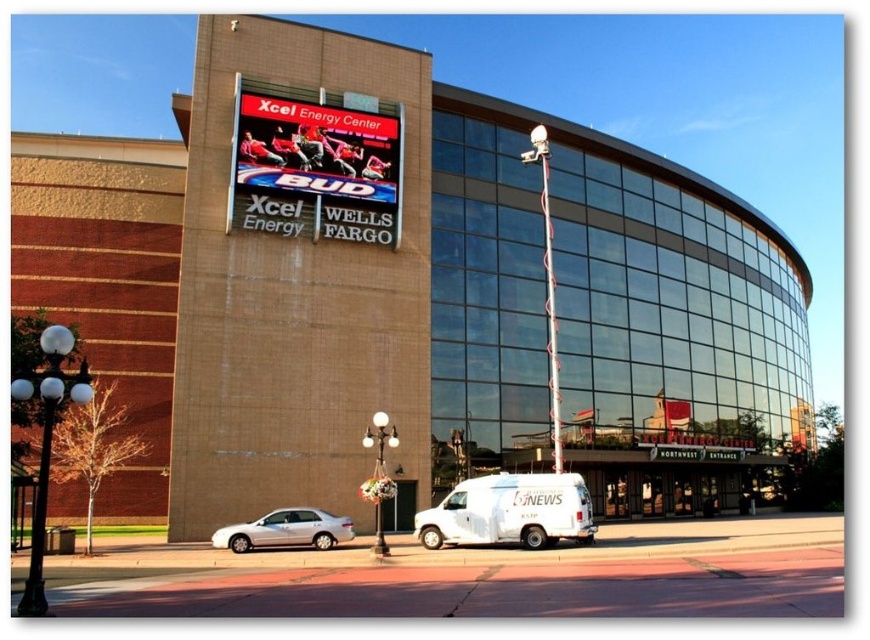
Question: Which of the following is the closest to the observer?

Choices:
 (A) click(x=554, y=340)
 (B) click(x=587, y=525)
 (C) click(x=322, y=545)

Answer: (B)

Question: Which object appears farthest from the camera in this image?

Choices:
 (A) white matte van at lower center
 (B) metallic spiral pole at upper center
 (C) silver metallic sedan at lower left

Answer: (B)

Question: Is silver metallic sedan at lower left further to camera compared to metallic spiral pole at upper center?

Choices:
 (A) yes
 (B) no

Answer: (B)

Question: Can you confirm if silver metallic sedan at lower left is positioned below metallic spiral pole at upper center?

Choices:
 (A) yes
 (B) no

Answer: (A)

Question: Considering the relative positions of silver metallic sedan at lower left and metallic spiral pole at upper center in the image provided, where is silver metallic sedan at lower left located with respect to metallic spiral pole at upper center?

Choices:
 (A) above
 (B) below

Answer: (B)

Question: Which point is farther from the camera taking this photo?

Choices:
 (A) (256, 524)
 (B) (553, 307)
 (C) (577, 536)

Answer: (B)